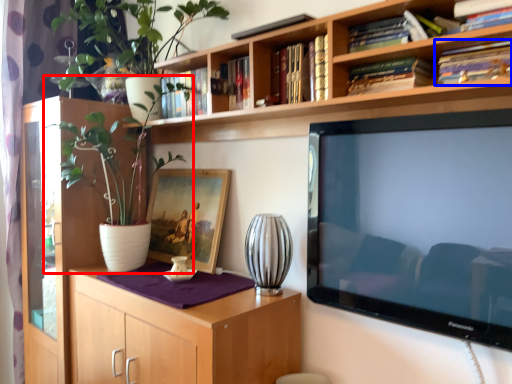
Question: Which of the following is the closest to the observer, houseplant (highlighted by a red box) or book (highlighted by a blue box)?

Choices:
 (A) houseplant
 (B) book

Answer: (B)